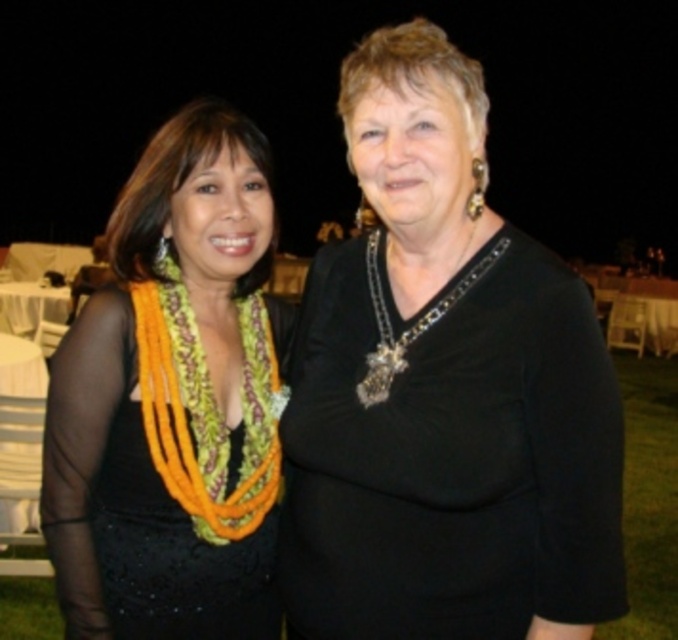
You are a photographer at a formal event and need to adjust the lighting to highlight the vibrant lei on the person at left. Given that the black matte dress at left is positioned at point (180, 403), where should you focus the light to ensure the lei stands out?

The point (180, 403) corresponds to the black matte dress at left, so to highlight the vibrant lei, focus the light on the area around the dress where the lei is located.

You are a photographer adjusting your camera settings to capture the details of the black velvet dress at center and the silver metallic chain at center. Which object should you focus on first if you want to ensure both are in sharp focus, considering their positions?

The black velvet dress at center is below the silver metallic chain at center, so you should focus on the silver metallic chain at center first to ensure both are in sharp focus.